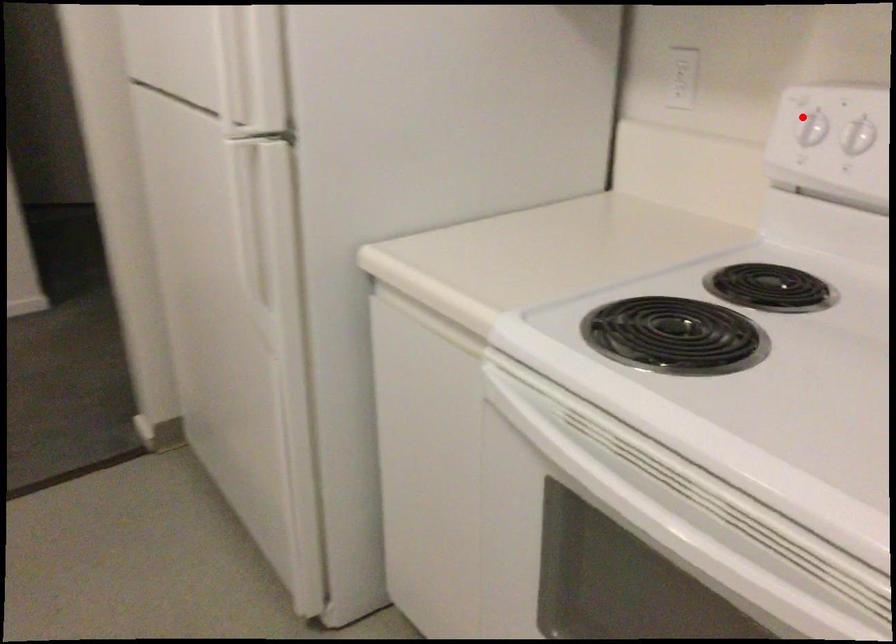
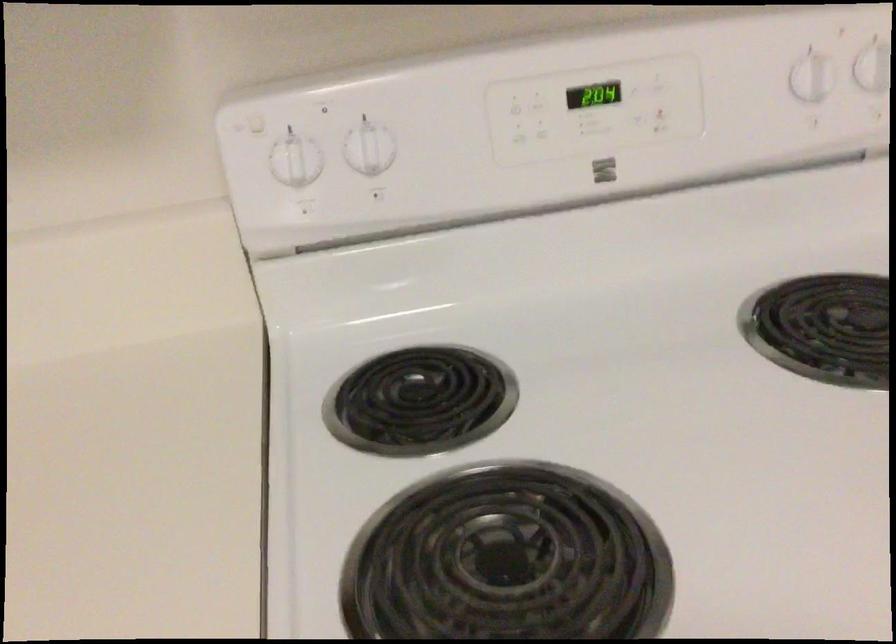
Question: I am providing you with two images of the same scene from different viewpoints. A red point is shown in image1. For the corresponding object point in image2, is it positioned nearer or farther from the camera?

Choices:
 (A) Nearer
 (B) Farther

Answer: (A)